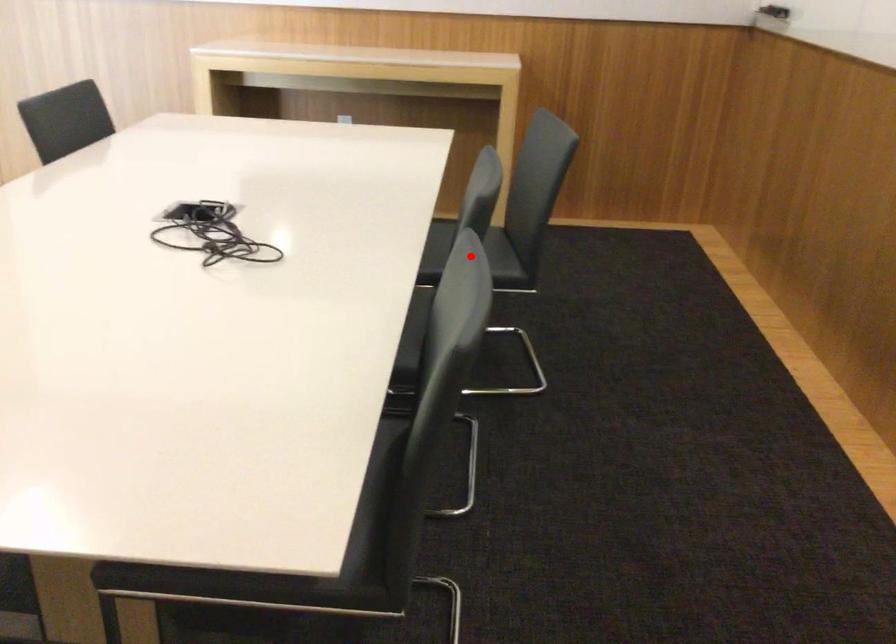
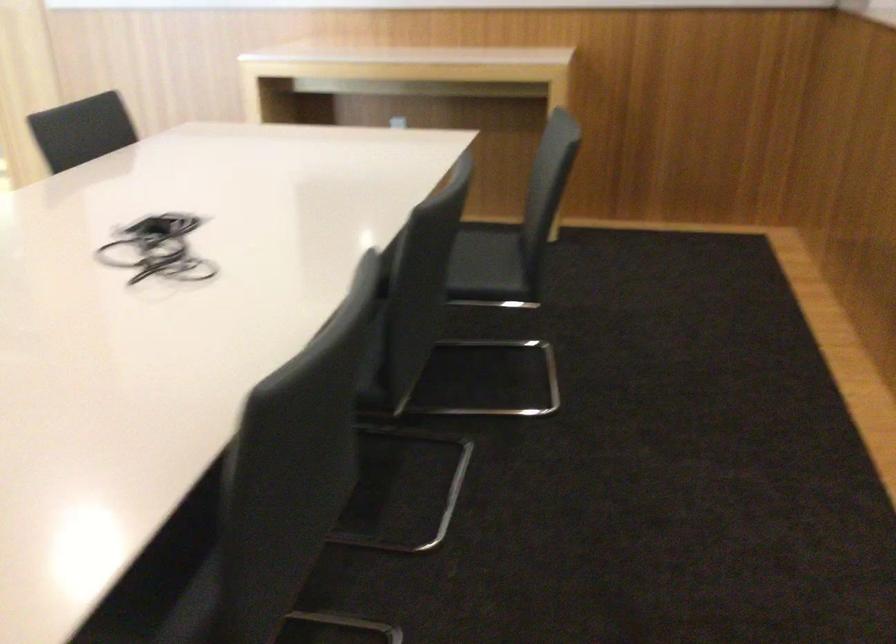
Question: I am providing you with two images of the same scene from different viewpoints. A red point is marked on the first image. Is the red point's position out of view in image 2?

Choices:
 (A) Yes
 (B) No

Answer: (A)